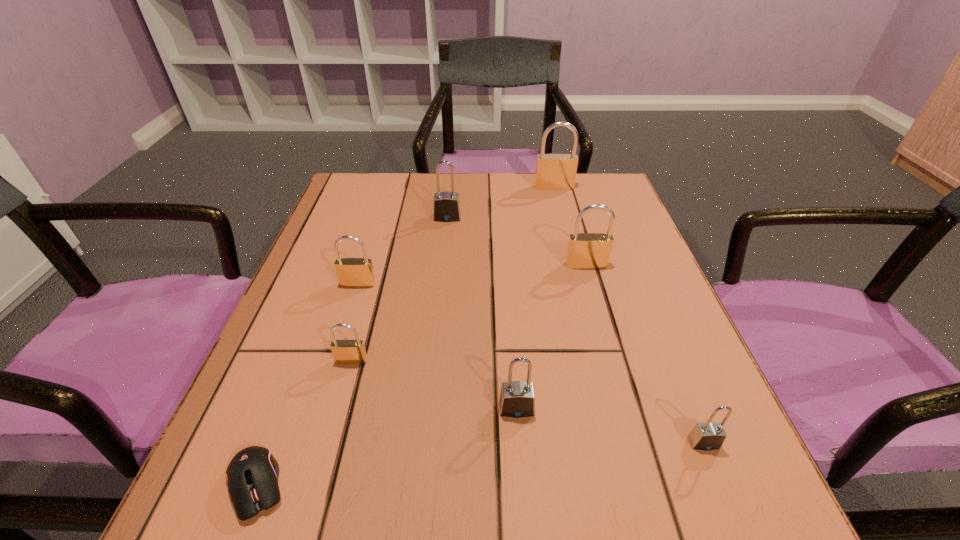
This screenshot has width=960, height=540. I want to click on the second closest brass padlock to the nearest brass padlock, so click(x=585, y=250).

The width and height of the screenshot is (960, 540). In order to click on the closest gray padlock to the tallest padlock in this screenshot , I will do click(446, 205).

Identify the location of gray padlock that is the second closest to the nearest brass padlock. The width and height of the screenshot is (960, 540). (446, 205).